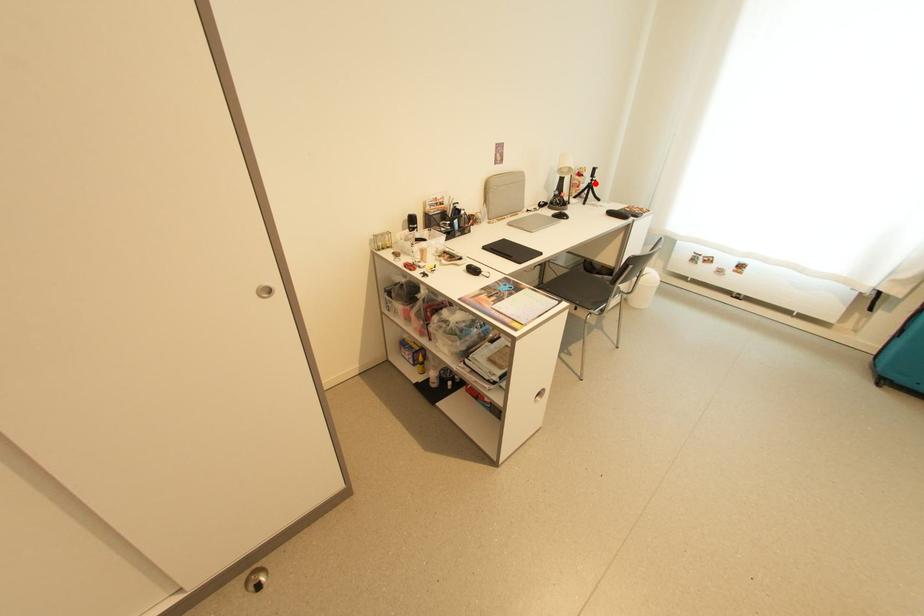
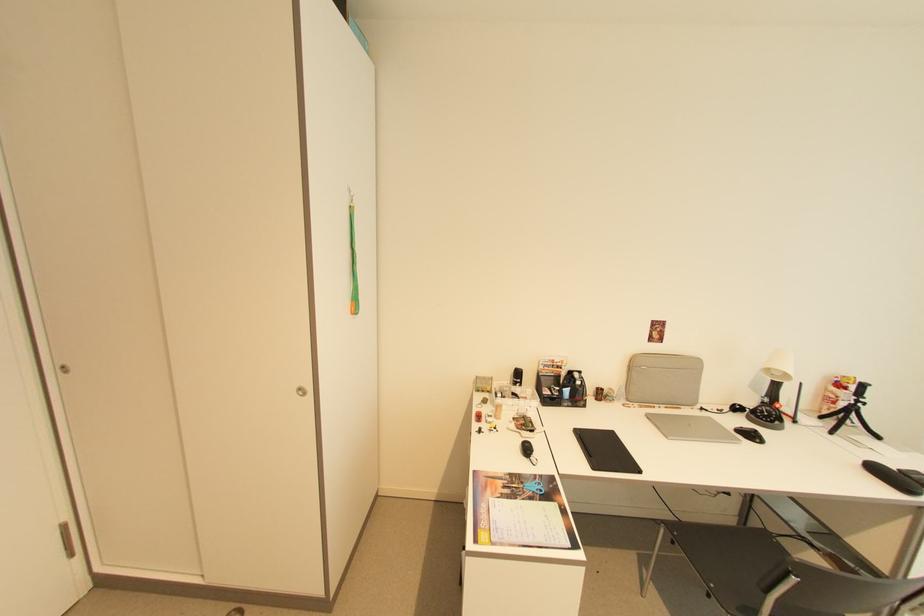
Question: I am providing you with two images of the same scene from different viewpoints. A red point is marked on the first image. At the location where the point appears in image 1, is it still visible in image 2?

Choices:
 (A) Yes
 (B) No

Answer: (A)